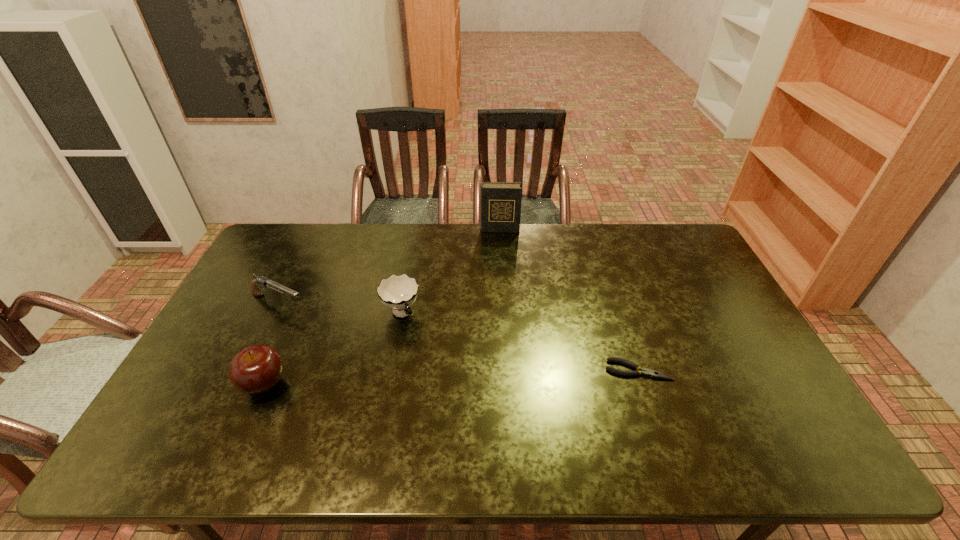
The image size is (960, 540). In order to click on vacant space located on the side of the cup with the handle in this screenshot , I will do `click(438, 374)`.

The height and width of the screenshot is (540, 960). What are the coordinates of `free space located on the side of the cup with the handle` in the screenshot? It's located at (418, 342).

Find the location of `free space located aiming along the barrel of the gun`. free space located aiming along the barrel of the gun is located at coordinates (391, 351).

Locate an element on the screen. The image size is (960, 540). vacant position located 0.050m aiming along the barrel of the gun is located at coordinates (317, 316).

You are a GUI agent. You are given a task and a screenshot of the screen. Output one action in this format:
    pyautogui.click(x=<x>, y=<y>)
    Task: Click on the vacant space located 0.230m aiming along the barrel of the gun
    The height and width of the screenshot is (540, 960).
    Given the screenshot: What is the action you would take?
    pyautogui.click(x=363, y=338)

You are a GUI agent. You are given a task and a screenshot of the screen. Output one action in this format:
    pyautogui.click(x=<x>, y=<y>)
    Task: Click on the free point located on the front cover of the farthest object
    
    Given the screenshot: What is the action you would take?
    pyautogui.click(x=499, y=293)

Identify the location of vacant space situated on the front cover of the farthest object. pyautogui.click(x=499, y=291).

Where is `free space located 0.190m on the front cover of the farthest object`? free space located 0.190m on the front cover of the farthest object is located at coordinates (499, 265).

Where is `object situated at the far edge`? This screenshot has width=960, height=540. object situated at the far edge is located at coordinates (500, 201).

Locate an element on the screen. This screenshot has height=540, width=960. object that is at the near edge is located at coordinates click(x=256, y=369).